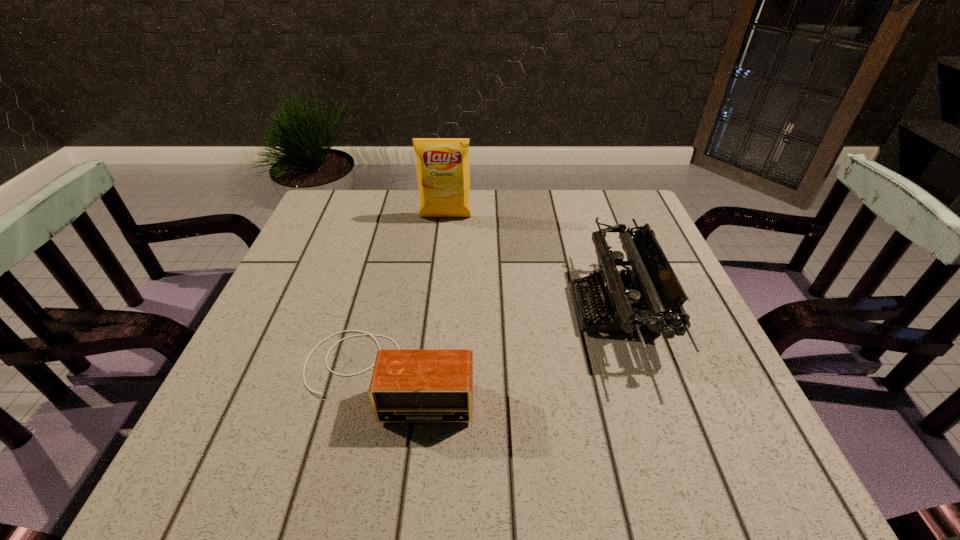
Locate an element on the screen. The height and width of the screenshot is (540, 960). object at the far edge is located at coordinates (442, 164).

The width and height of the screenshot is (960, 540). I want to click on object that is at the left edge, so click(x=408, y=385).

You are a GUI agent. You are given a task and a screenshot of the screen. Output one action in this format:
    pyautogui.click(x=<x>, y=<y>)
    Task: Click on the object at the right edge
    The image size is (960, 540).
    Given the screenshot: What is the action you would take?
    pyautogui.click(x=647, y=298)

Find the location of a particular element. free location at the far edge is located at coordinates (452, 236).

At what (x,y) coordinates should I click in order to perform the action: click on free space at the right edge of the desktop. Please return your answer as a coordinate pair (x, y). This screenshot has width=960, height=540. Looking at the image, I should click on (734, 397).

In order to click on vacant space at the far left corner of the desktop in this screenshot , I will do `click(337, 226)`.

Find the location of a particular element. The height and width of the screenshot is (540, 960). vacant space at the near right corner of the desktop is located at coordinates point(711,472).

The image size is (960, 540). What are the coordinates of `unoccupied position between the tallest object and the second shortest object` in the screenshot? It's located at (530, 263).

The height and width of the screenshot is (540, 960). I want to click on unoccupied area between the shortest object and the tallest object, so click(x=417, y=295).

Where is `vacant space that's between the radio receiver and the rightmost object`? vacant space that's between the radio receiver and the rightmost object is located at coordinates (501, 341).